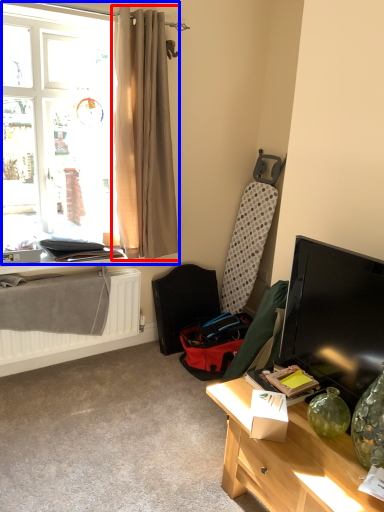
Question: Which object is closer to the camera taking this photo, curtain (highlighted by a red box) or window (highlighted by a blue box)?

Choices:
 (A) curtain
 (B) window

Answer: (B)